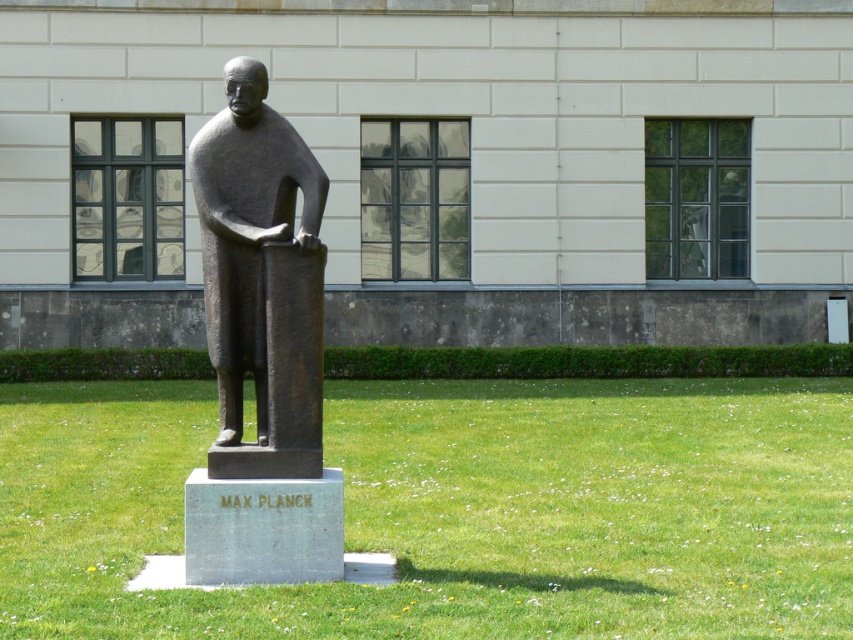
Is green grass at center shorter than bronze statue at center?

Correct, green grass at center is not as tall as bronze statue at center.

Where is `green grass at center`? Image resolution: width=853 pixels, height=640 pixels. green grass at center is located at coordinates (456, 509).